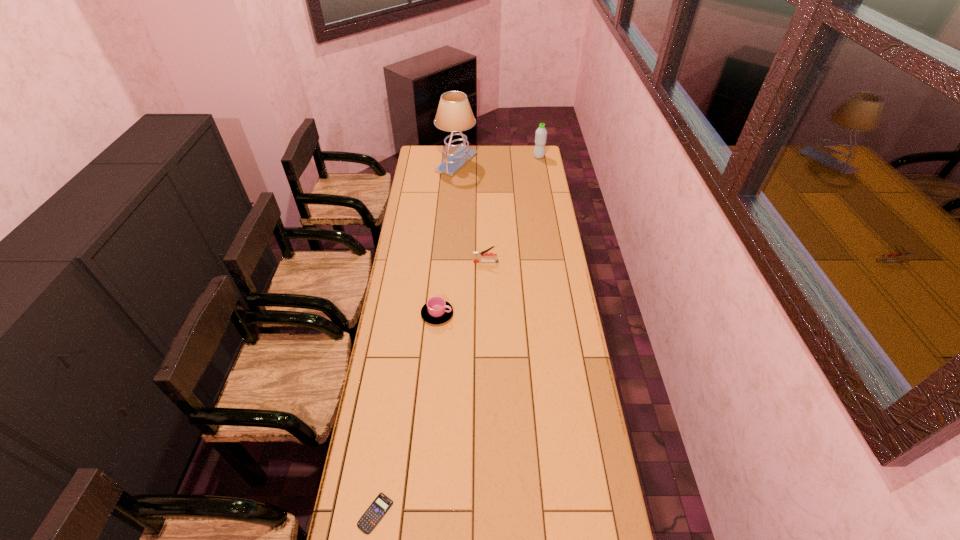
Locate an element on the screen. This screenshot has height=540, width=960. the tallest object is located at coordinates (454, 114).

In order to click on the rightmost object in this screenshot , I will do `click(541, 133)`.

Locate an element on the screen. water bottle is located at coordinates pyautogui.click(x=541, y=133).

Identify the location of the third shortest object. (477, 255).

Locate an element on the screen. The image size is (960, 540). stapler is located at coordinates (477, 255).

You are a GUI agent. You are given a task and a screenshot of the screen. Output one action in this format:
    pyautogui.click(x=<x>, y=<y>)
    Task: Click on the cup
    This screenshot has width=960, height=540.
    Given the screenshot: What is the action you would take?
    pyautogui.click(x=436, y=311)

The height and width of the screenshot is (540, 960). What are the coordinates of `the second nearest object` in the screenshot? It's located at (436, 311).

I want to click on the shortest object, so click(x=372, y=516).

At what (x,y) coordinates should I click in order to perform the action: click on the nearest object. Please return your answer as a coordinate pair (x, y). Looking at the image, I should click on (372, 516).

The image size is (960, 540). What are the coordinates of `blank space located 0.100m on the front of the tallest object` in the screenshot? It's located at (455, 187).